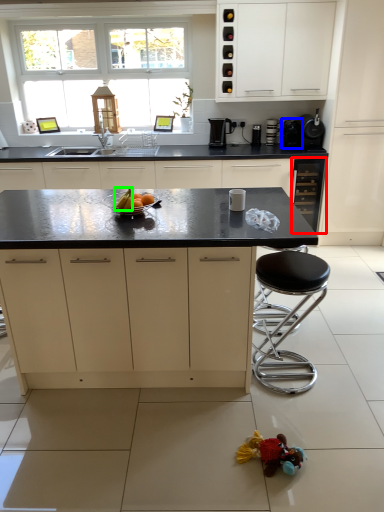
Question: Which object is the farthest from cabinetry (highlighted by a red box)? Choose among these: appliance (highlighted by a blue box) or fruit (highlighted by a green box).

Choices:
 (A) appliance
 (B) fruit

Answer: (B)